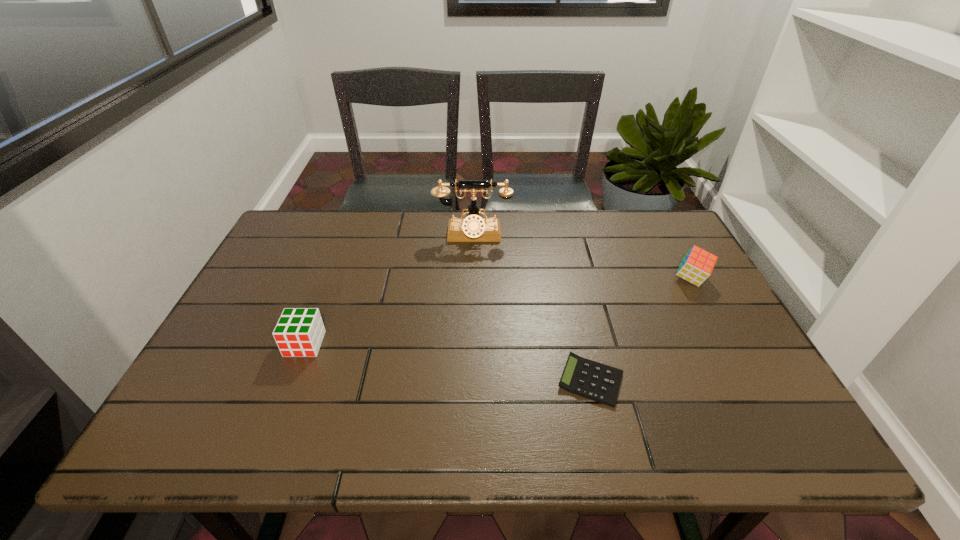
What are the coordinates of `the closest object to the farther cube` in the screenshot? It's located at (589, 379).

You are a GUI agent. You are given a task and a screenshot of the screen. Output one action in this format:
    pyautogui.click(x=<x>, y=<y>)
    Task: Click on the free region that satisfies the following two spatial constraints: 1. on the red face of the calculator; 2. on the right side of the left cube
    
    Given the screenshot: What is the action you would take?
    pyautogui.click(x=291, y=381)

Image resolution: width=960 pixels, height=540 pixels. What are the coordinates of `free spot that satisfies the following two spatial constraints: 1. on the red face of the shortest object; 2. on the right side of the leftmost object` in the screenshot? It's located at (291, 381).

Image resolution: width=960 pixels, height=540 pixels. I want to click on vacant region that satisfies the following two spatial constraints: 1. on the red face of the shorter cube; 2. on the right side of the second object from right to left, so click(x=291, y=381).